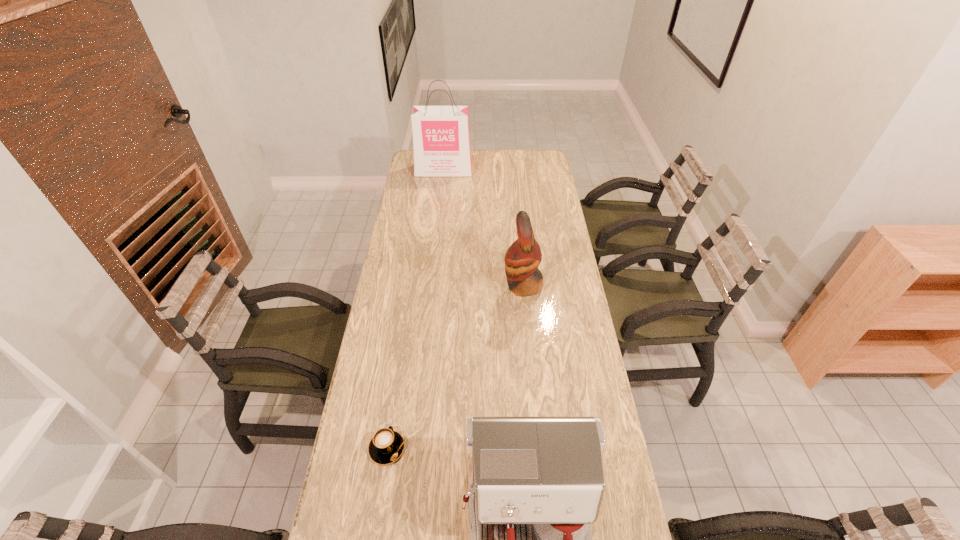
You are a GUI agent. You are given a task and a screenshot of the screen. Output one action in this format:
    pyautogui.click(x=<x>, y=<y>)
    Task: Click on the farthest object
    
    Given the screenshot: What is the action you would take?
    pyautogui.click(x=441, y=143)

I want to click on the tallest object, so click(441, 143).

Where is `parrot`? parrot is located at coordinates (523, 257).

I want to click on the shortest object, so click(387, 445).

Find the location of a particular element. The width and height of the screenshot is (960, 540). free point located 0.140m on the front-facing side of the tallest object is located at coordinates (442, 192).

Locate an element on the screen. The height and width of the screenshot is (540, 960). free space located on the face of the parrot is located at coordinates (475, 285).

Identify the location of free region located on the face of the parrot. (452, 285).

The height and width of the screenshot is (540, 960). What are the coordinates of `vacant space situated on the face of the parrot` in the screenshot? It's located at (444, 285).

I want to click on vacant region located 0.170m on the back of the shortest object, so click(397, 381).

Identify the location of object located at the far edge. This screenshot has width=960, height=540. (441, 143).